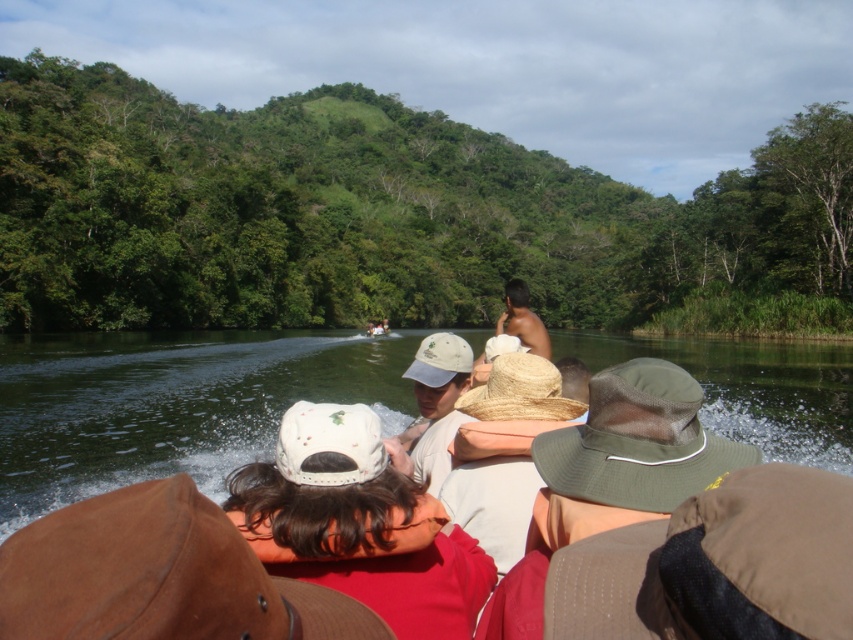
Question: Does green leafy hillside at upper center have a greater width compared to white matte baseball cap at center?

Choices:
 (A) no
 (B) yes

Answer: (B)

Question: Observing the image, what is the correct spatial positioning of green leafy hillside at upper center in reference to white matte baseball cap at center?

Choices:
 (A) left
 (B) right

Answer: (A)

Question: Is green leafy hillside at upper center to the left of white matte baseball cap at center from the viewer's perspective?

Choices:
 (A) yes
 (B) no

Answer: (A)

Question: Which object is closer to the camera taking this photo?

Choices:
 (A) green leafy hillside at upper center
 (B) white matte baseball cap at center

Answer: (B)